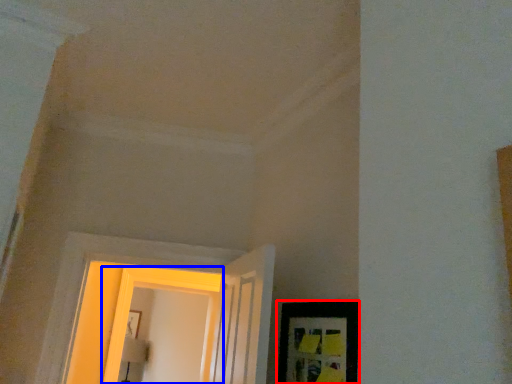
Question: Which point is closer to the camera, picture frame (highlighted by a red box) or window (highlighted by a blue box)?

Choices:
 (A) picture frame
 (B) window

Answer: (A)